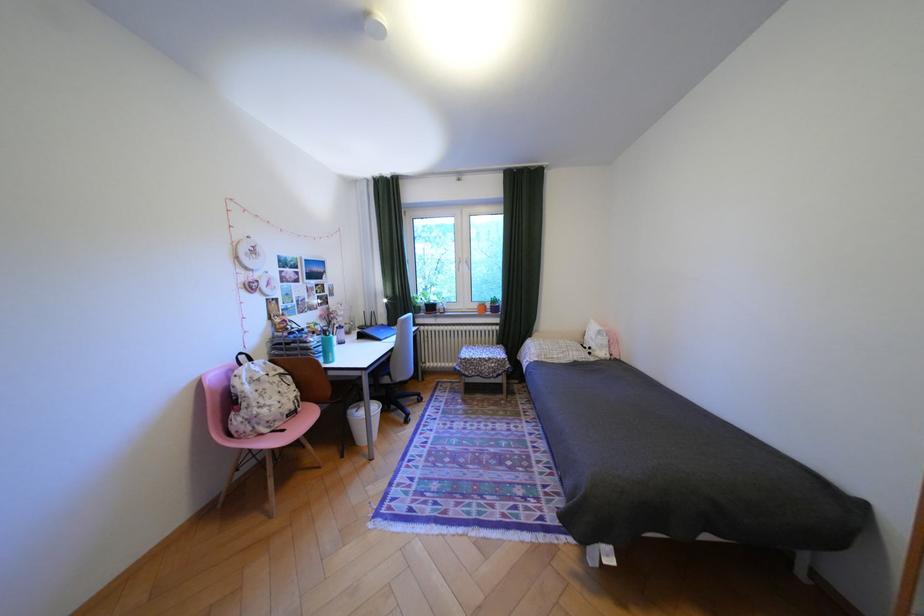
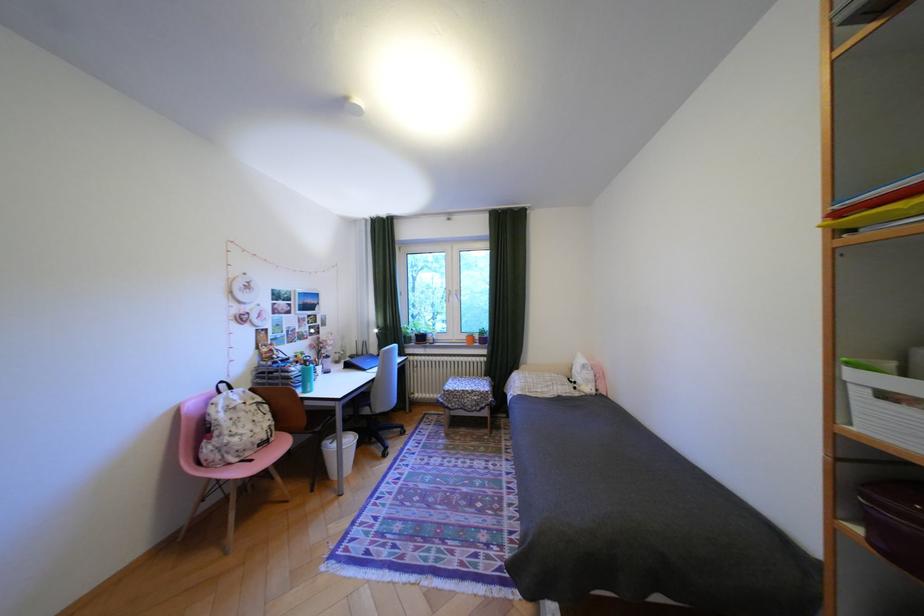
Question: The images are taken continuously from a first-person perspective. In which direction are you moving?

Choices:
 (A) Left
 (B) Right
 (C) Forward
 (D) Backward

Answer: (B)